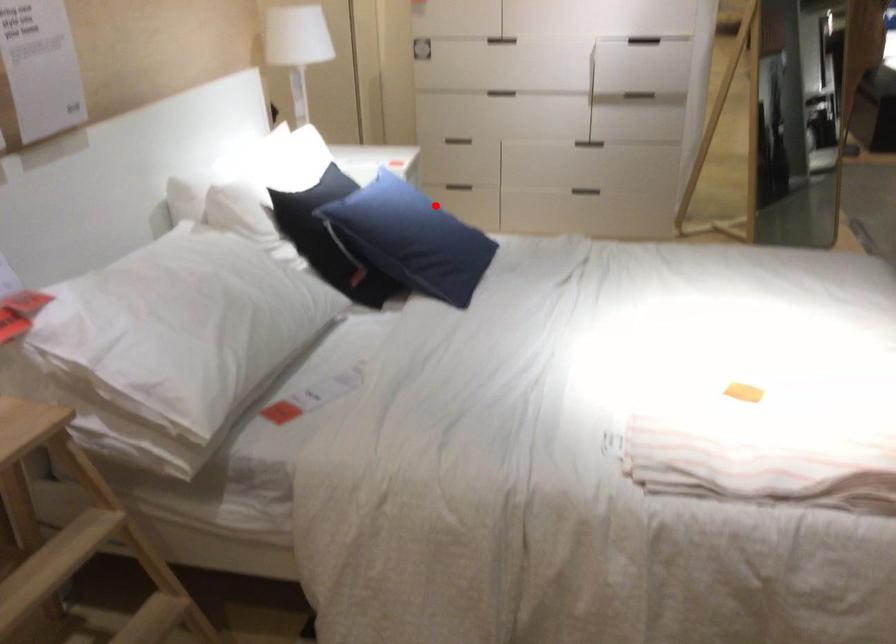
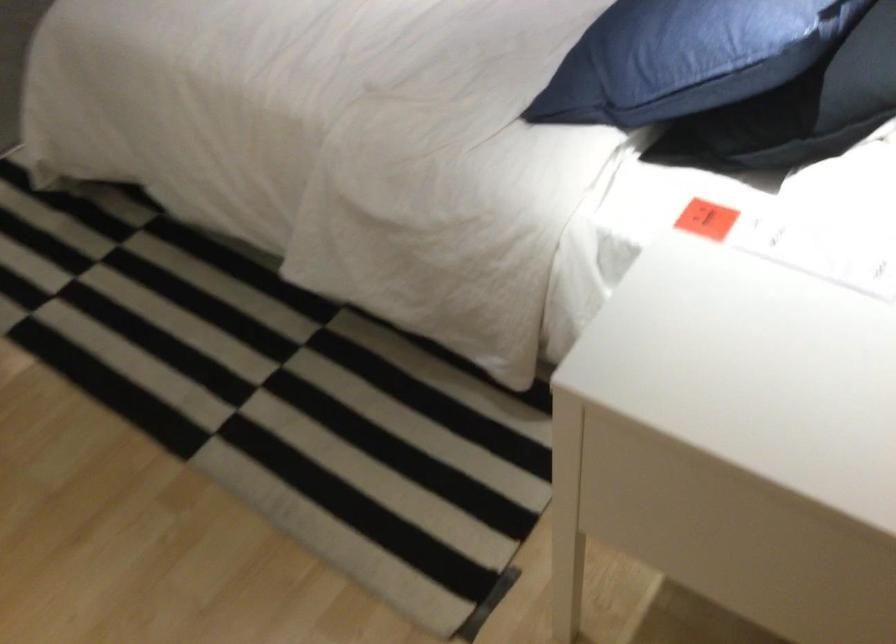
Question: I am providing you with two images of the same scene from different viewpoints. Image1 has a red point marked. In image2, the corresponding 3D location appears at what relative position? Reply with the corresponding letter.

Choices:
 (A) Closer
 (B) Farther

Answer: (A)